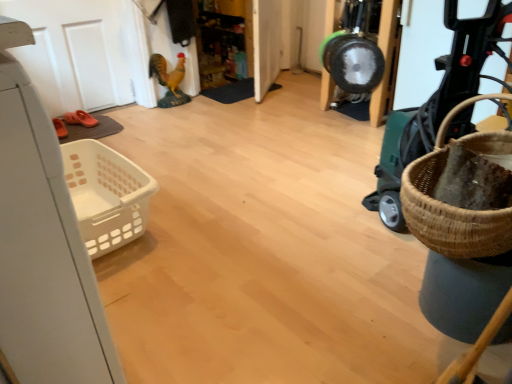
The height and width of the screenshot is (384, 512). In order to click on empty space that is in between green plastic baby carriage at right and white glossy door at center, the second door when ordered from left to right in this screenshot , I will do `click(314, 134)`.